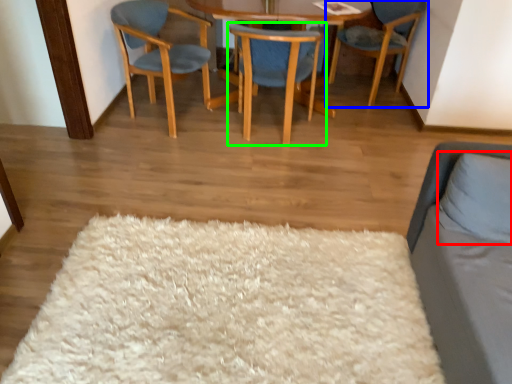
Question: Which object is the farthest from pillow (highlighted by a red box)? Choose among these: chair (highlighted by a blue box) or chair (highlighted by a green box).

Choices:
 (A) chair
 (B) chair

Answer: (A)